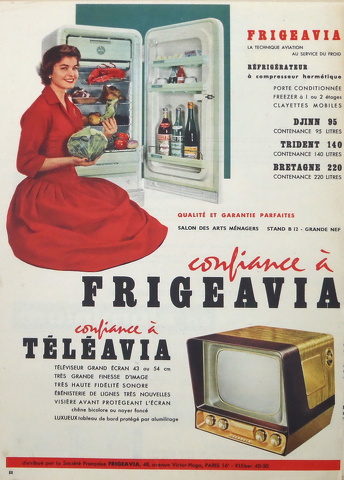
This screenshot has height=480, width=344. I want to click on refrigerator, so point(86,29).